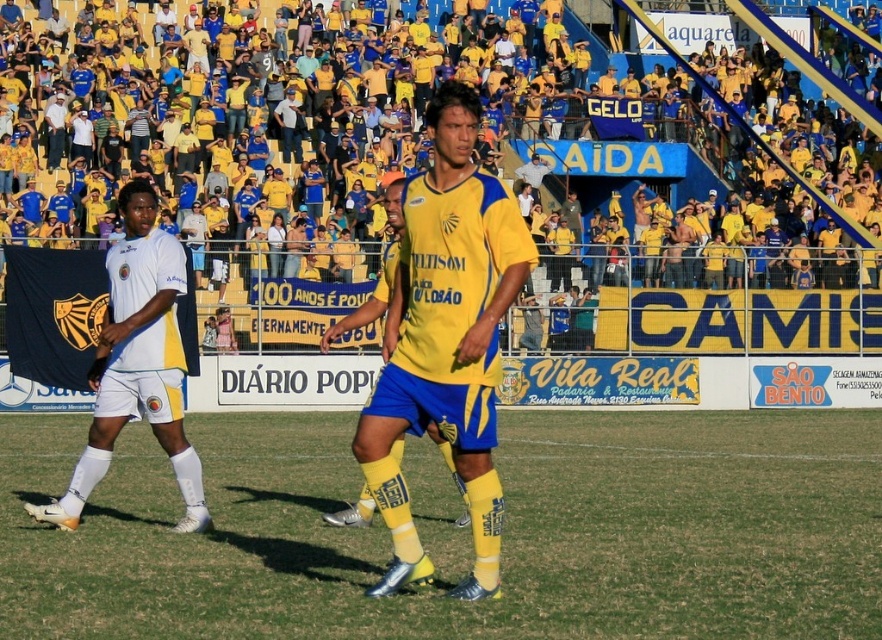
Question: Which object appears closest to the camera in this image?

Choices:
 (A) green grass at center
 (B) yellow jersey at upper center

Answer: (A)

Question: Does yellow matte jersey at center appear on the right side of white matte shorts at left?

Choices:
 (A) yes
 (B) no

Answer: (A)

Question: Is green grass at center bigger than yellow matte jersey at center?

Choices:
 (A) no
 (B) yes

Answer: (B)

Question: Which point appears closest to the camera in this image?

Choices:
 (A) (253, 456)
 (B) (303, 132)

Answer: (A)

Question: Does green grass at center appear on the right side of yellow matte jersey at center?

Choices:
 (A) yes
 (B) no

Answer: (B)

Question: Which point is farther to the camera?

Choices:
 (A) yellow jersey at upper center
 (B) yellow matte jersey at center

Answer: (A)